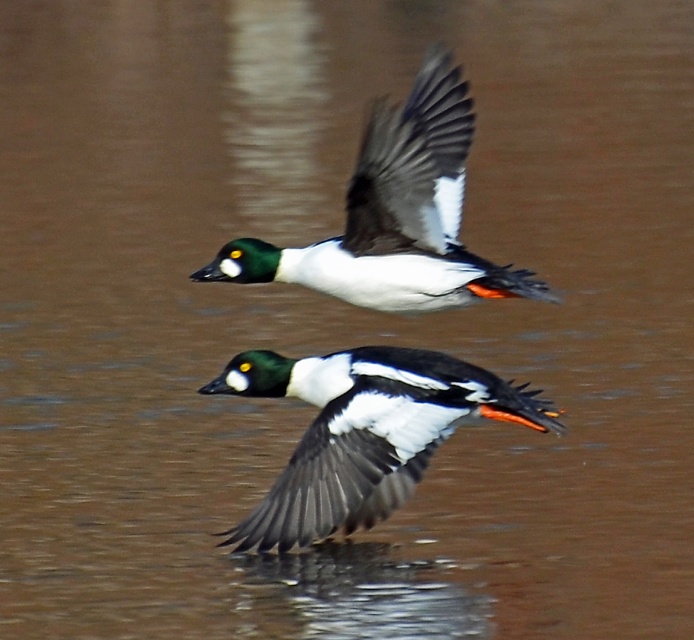
You are a birdwatcher observing two shiny black ducks in flight. You notice the shiny black duck at center and the shiny black duck at upper center. Which one appears to be closer to you based on their sizes?

The shiny black duck at center appears closer because it is smaller than the shiny black duck at upper center, which is further away.

You are standing on the shore of the lake and see a point marked at coordinates (363,432). What object is located at that point?

The point at (363,432) indicates a shiny black duck at center.